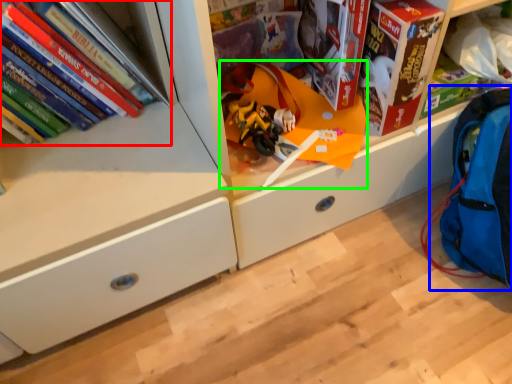
Question: Considering the real-world distances, which object is farthest from book (highlighted by a red box)? backpack (highlighted by a blue box) or toy (highlighted by a green box)?

Choices:
 (A) backpack
 (B) toy

Answer: (A)